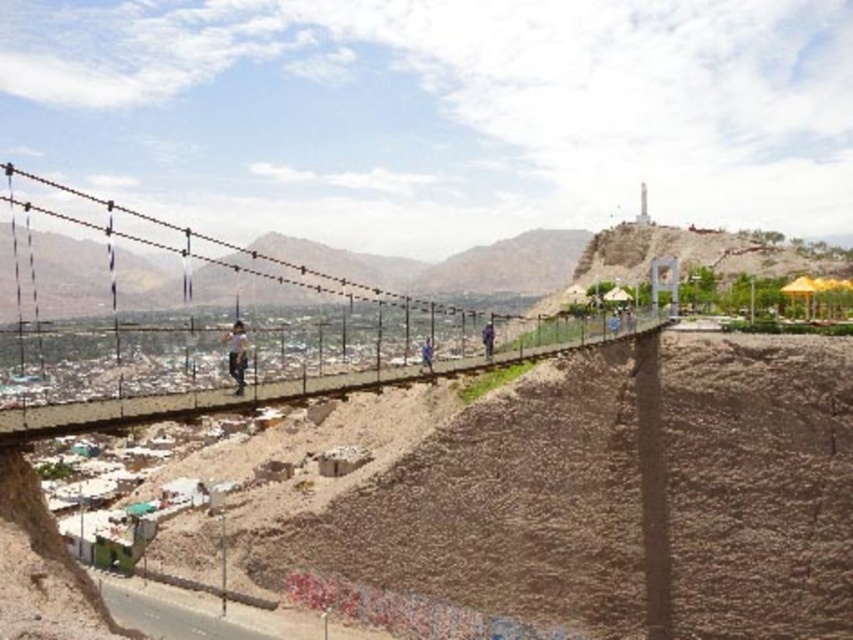
You are a hiker standing on the suspension bridge and see the light brown wooden stick at center and the blue fabric person at center. Which object is closer to the dry riverbed?

The light brown wooden stick at center is closer to the dry riverbed because it is located below the blue fabric person at center.

You are a hiker who wants to cross the suspension bridge. You notice a light brown wooden stick at center and a dark blue jeans at center on the bridge. Which object is wider?

The light brown wooden stick at center might be wider than dark blue jeans at center.

You are a hiker planning to cross the suspension bridge. You notice the brown sandy dirt track at center and the dark blue jeans at center. Which object is wider?

The brown sandy dirt track at center is wider than the dark blue jeans at center.